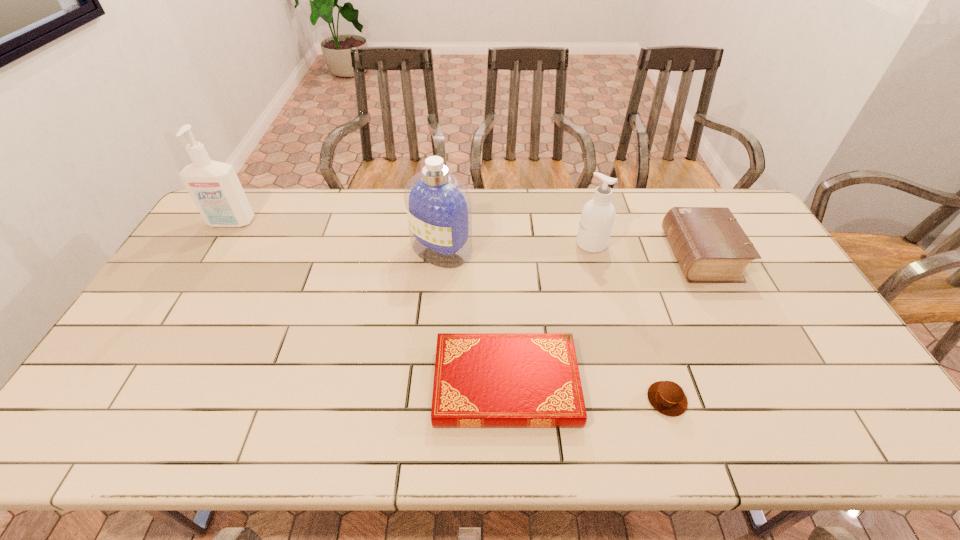
At what (x,y) coordinates should I click in order to perform the action: click on vacant space that's between the Bible and the hardback book. Please return your answer as a coordinate pair (x, y). The width and height of the screenshot is (960, 540). Looking at the image, I should click on (604, 320).

Identify the location of unoccupied position between the second cleansing agent from right to left and the muffin. This screenshot has height=540, width=960. (554, 325).

Identify the location of unoccupied position between the Bible and the muffin. The height and width of the screenshot is (540, 960). (684, 327).

Find the location of `free space between the hardback book and the leftmost object`. free space between the hardback book and the leftmost object is located at coordinates (369, 303).

Where is `free area in between the shortest cleansing agent and the rightmost object`? Image resolution: width=960 pixels, height=540 pixels. free area in between the shortest cleansing agent and the rightmost object is located at coordinates (646, 249).

This screenshot has height=540, width=960. In order to click on vacant space in between the leftmost cleansing agent and the hardback book in this screenshot , I will do `click(369, 303)`.

This screenshot has height=540, width=960. Identify the location of vacant area that lies between the hardback book and the leftmost object. (369, 303).

At what (x,y) coordinates should I click in order to perform the action: click on vacant space that is in between the hardback book and the muffin. Please return your answer as a coordinate pair (x, y). Looking at the image, I should click on (587, 392).

Where is `empty location between the third shortest object and the fourth shortest object`? Image resolution: width=960 pixels, height=540 pixels. empty location between the third shortest object and the fourth shortest object is located at coordinates (646, 249).

Where is `object that ranks as the second closest to the muffin`? The height and width of the screenshot is (540, 960). object that ranks as the second closest to the muffin is located at coordinates (710, 246).